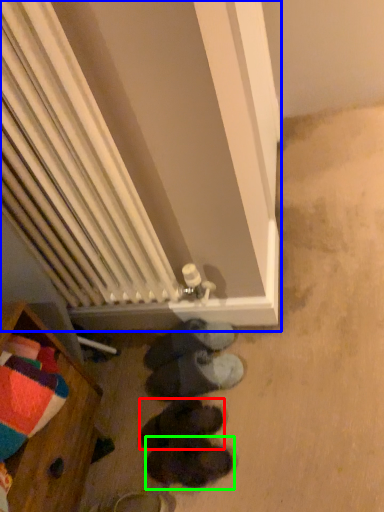
Question: Which object is the closest to the footwear (highlighted by a red box)? Choose among these: furnurniture (highlighted by a blue box) or footwear (highlighted by a green box).

Choices:
 (A) furnurniture
 (B) footwear

Answer: (B)